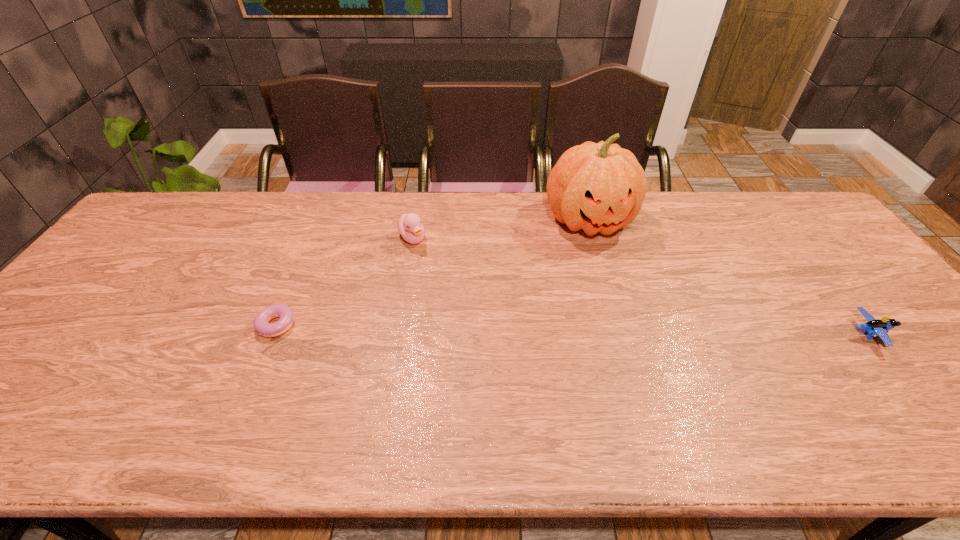
You are a GUI agent. You are given a task and a screenshot of the screen. Output one action in this format:
    pyautogui.click(x=<x>, y=<y>)
    Task: Click on the vacant area between the shortest object and the second tallest object
    This screenshot has height=540, width=960.
    Given the screenshot: What is the action you would take?
    pyautogui.click(x=346, y=282)

Where is `vacant area that lies between the leftmost object and the tallest object`? This screenshot has width=960, height=540. vacant area that lies between the leftmost object and the tallest object is located at coordinates (435, 273).

Find the location of `vacant area that lies between the Lego and the second object from left to right`. vacant area that lies between the Lego and the second object from left to right is located at coordinates (639, 287).

Locate an element on the screen. unoccupied area between the doughnut and the tallest object is located at coordinates (435, 273).

Find the location of `vacant area that lies between the rightmost object and the third shortest object`. vacant area that lies between the rightmost object and the third shortest object is located at coordinates (639, 287).

Locate an element on the screen. This screenshot has height=540, width=960. free point between the Lego and the doughnut is located at coordinates (573, 329).

You are a GUI agent. You are given a task and a screenshot of the screen. Output one action in this format:
    pyautogui.click(x=<x>, y=<y>)
    Task: Click on the second closest object to the tallest object
    This screenshot has height=540, width=960.
    Given the screenshot: What is the action you would take?
    pyautogui.click(x=874, y=327)

Where is `object that is the third closest to the pumpkin`? object that is the third closest to the pumpkin is located at coordinates point(261,323).

You are a GUI agent. You are given a task and a screenshot of the screen. Output one action in this format:
    pyautogui.click(x=<x>, y=<y>)
    Task: Click on the free space in the image that satisfies the following two spatial constraints: 1. on the back side of the second object from left to right; 2. on the right side of the pumpkin
    The image size is (960, 540).
    Given the screenshot: What is the action you would take?
    pyautogui.click(x=415, y=220)

This screenshot has width=960, height=540. Find the location of `vacant space that satisfies the following two spatial constraints: 1. on the front side of the rightmost object; 2. on the front-facing side of the doughnut`. vacant space that satisfies the following two spatial constraints: 1. on the front side of the rightmost object; 2. on the front-facing side of the doughnut is located at coordinates (276, 334).